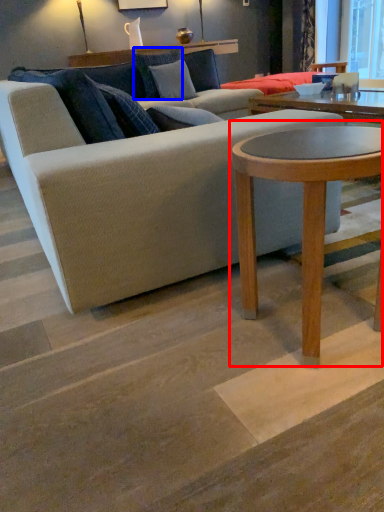
Question: Among these objects, which one is farthest to the camera, coffee table (highlighted by a red box) or pillow (highlighted by a blue box)?

Choices:
 (A) coffee table
 (B) pillow

Answer: (B)